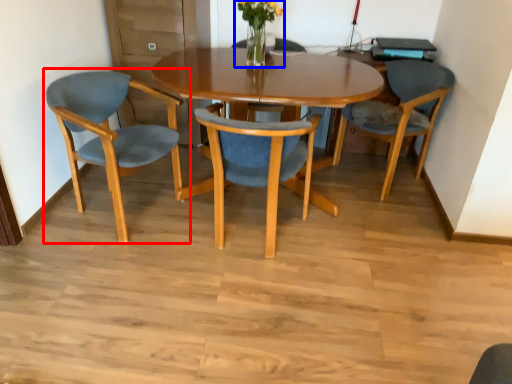
Question: Which object is closer to the camera taking this photo, chair (highlighted by a red box) or floral arrangement (highlighted by a blue box)?

Choices:
 (A) chair
 (B) floral arrangement

Answer: (A)